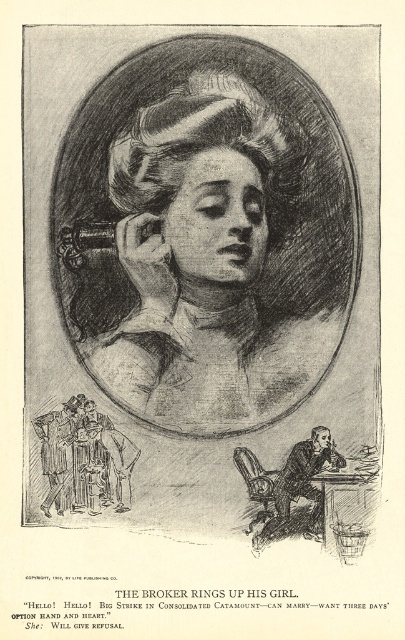
Between smooth paper desk at lower right and smooth skin head at center, which one is positioned lower?

smooth paper desk at lower right

The height and width of the screenshot is (640, 405). What do you see at coordinates (298, 486) in the screenshot?
I see `smooth paper desk at lower right` at bounding box center [298, 486].

Who is more forward, (300, 442) or (93, 410)?

Point (300, 442) is in front.

Where is `smooth paper desk at lower right`? The height and width of the screenshot is (640, 405). smooth paper desk at lower right is located at coordinates (298, 486).

Who is positioned more to the right, smooth skin head at lower right or smooth skin head at center?

smooth skin head at lower right is more to the right.

Is smooth skin head at lower right below smooth skin head at center?

Yes, smooth skin head at lower right is below smooth skin head at center.

This screenshot has height=640, width=405. What are the coordinates of `smooth skin head at lower right` in the screenshot? It's located at (321, 438).

This screenshot has width=405, height=640. Find the location of `smooth skin head at lower right`. smooth skin head at lower right is located at coordinates (321, 438).

Who is positioned more to the right, smooth paper-like face at center or matte black hair at center?

matte black hair at center is more to the right.

Which of these two, smooth paper-like face at center or matte black hair at center, stands taller?

smooth paper-like face at center

The height and width of the screenshot is (640, 405). What do you see at coordinates (200, 262) in the screenshot? I see `smooth paper-like face at center` at bounding box center [200, 262].

In order to click on smooth paper-like face at center in this screenshot , I will do pos(200,262).